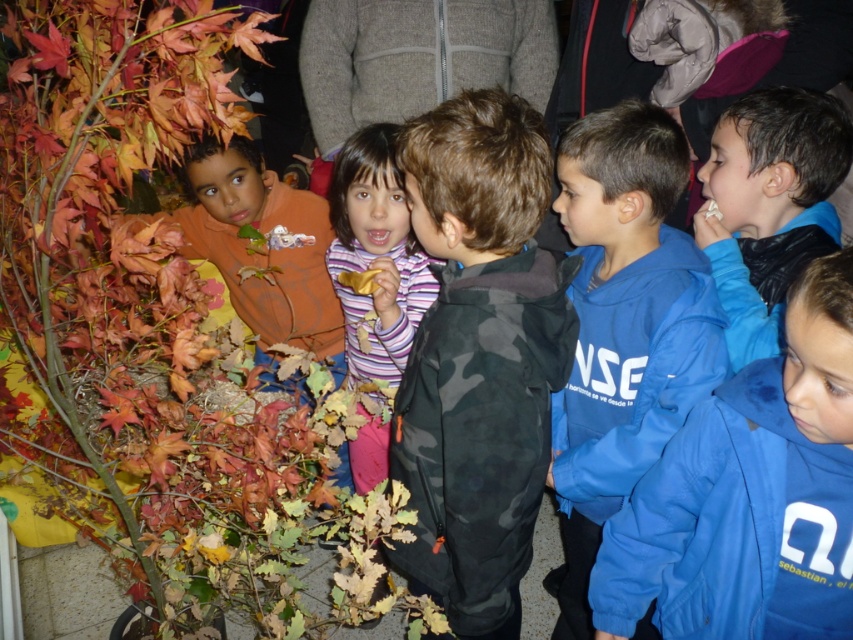
You are a teacher in the classroom and want to hand out a worksheet to the student wearing the camouflage jacket at center and the student wearing the blue fleece jacket at right. If you start at the front of the classroom, which student should you approach first based on their position?

The camouflage jacket at center is to the left of the blue fleece jacket at right. Since the teacher is at the front, the student wearing the camouflage jacket at center is on the left side, so you should approach them first before moving to the right to reach the blue fleece jacket at right.

In the scene shown: You are a photographer trying to capture a candid shot of the blue fleece sweatshirt at center without including the camouflage jacket at center in the frame. Based on their positions, is this possible? Explain your reasoning.

The camouflage jacket at center is to the left of the blue fleece sweatshirt at center. Since they are both at the center but positioned side by side, it might be challenging to capture the blue fleece sweatshirt without including the camouflage jacket in the frame unless you angle the camera to exclude the left side.